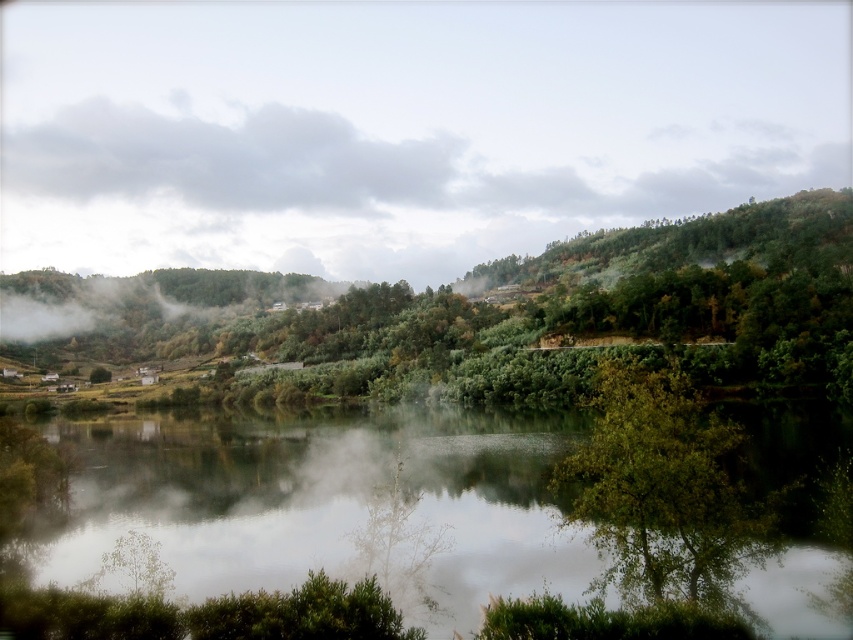
Question: Is white misty fog at center in front of green leafy tree at lower right?

Choices:
 (A) no
 (B) yes

Answer: (A)

Question: Which of the following is the farthest from the observer?

Choices:
 (A) green leafy tree at lower right
 (B) white misty fog at center
 (C) green reflective water at center

Answer: (B)

Question: Observing the image, what is the correct spatial positioning of green reflective water at center in reference to green leafy tree at lower right?

Choices:
 (A) below
 (B) above

Answer: (A)

Question: Which object is the farthest from the white misty fog at center?

Choices:
 (A) green reflective water at center
 (B) green leafy tree at lower right

Answer: (B)

Question: Which of the following is the closest to the observer?

Choices:
 (A) (635, 404)
 (B) (395, 550)

Answer: (A)

Question: Is green reflective water at center positioned behind green leafy tree at lower right?

Choices:
 (A) no
 (B) yes

Answer: (A)